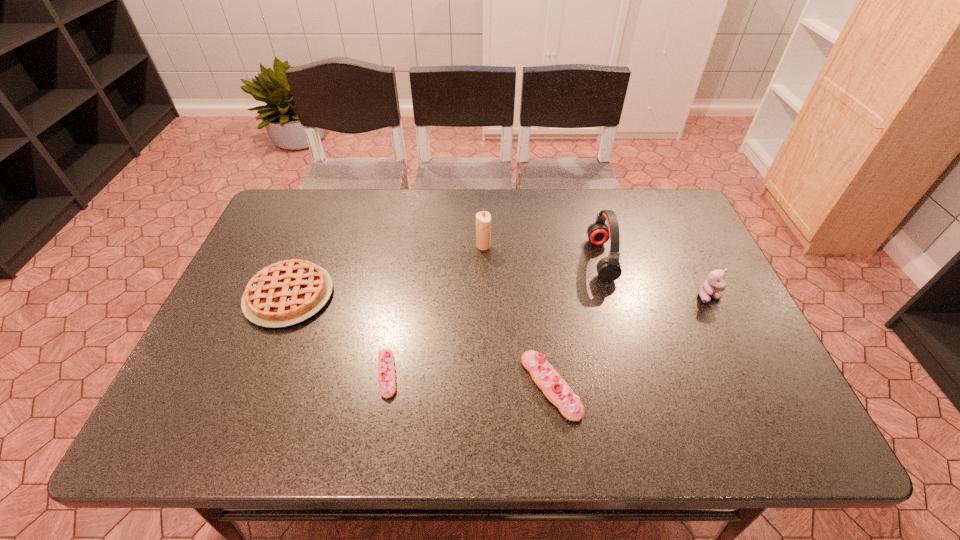
Identify the location of free space at the near edge of the desktop. Image resolution: width=960 pixels, height=540 pixels. (378, 377).

This screenshot has width=960, height=540. In the image, there is a desktop. Find the location of `free space at the left edge`. free space at the left edge is located at coordinates (259, 268).

This screenshot has height=540, width=960. I want to click on vacant space at the near left corner of the desktop, so click(x=248, y=379).

The width and height of the screenshot is (960, 540). In order to click on vacant space at the far right corner of the desktop in this screenshot , I will do `click(649, 215)`.

This screenshot has width=960, height=540. In the image, there is a desktop. In order to click on free space at the near right corner in this screenshot , I will do `click(759, 373)`.

Locate an element on the screen. This screenshot has width=960, height=540. free spot between the third object from left to right and the pie is located at coordinates (386, 271).

Where is `vacant area that lies between the second object from left to right and the fourth object from right to left`? Image resolution: width=960 pixels, height=540 pixels. vacant area that lies between the second object from left to right and the fourth object from right to left is located at coordinates (435, 310).

This screenshot has height=540, width=960. What are the coordinates of `unoccupied area between the right eclair and the earphone` in the screenshot? It's located at (576, 322).

Locate an element on the screen. free spot between the rightmost object and the shorter eclair is located at coordinates (548, 335).

Locate an element on the screen. Image resolution: width=960 pixels, height=540 pixels. vacant area between the shorter eclair and the third tallest object is located at coordinates (548, 335).